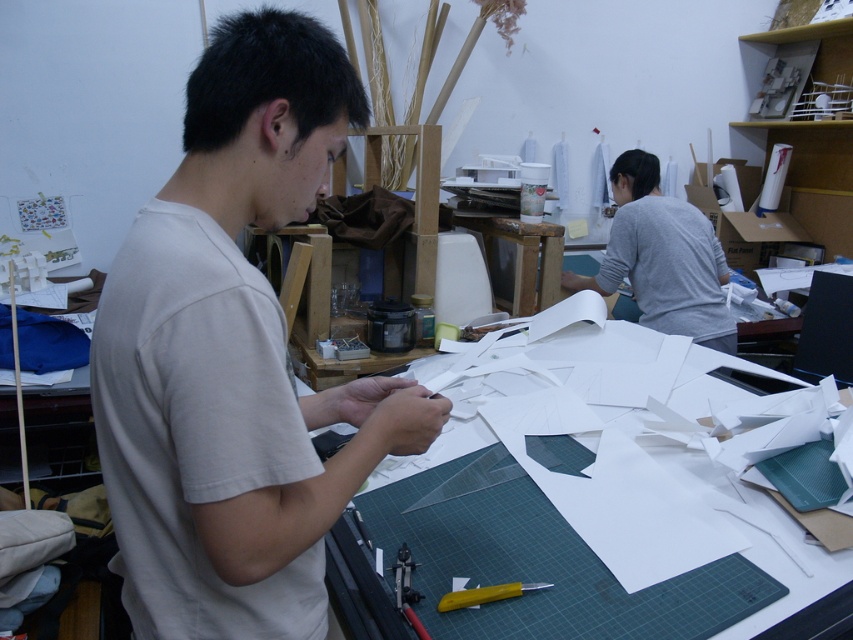
You are standing in front of the workspace and want to determine which of the two points, point (279,630) or point (654,476), is nearer to you. Based on the scene, which point is closer?

Point (279,630) is closer to the viewer than point (654,476).

You are an observer looking at the workspace. Which object is smaller in size between the white matte shirt at center and the white paper at center?

The white matte shirt at center has a smaller size compared to the white paper at center, so the white matte shirt at center is smaller.

You are an observer standing in front of the workspace. You notice the white matte shirt at center and the white paper at center. Which object is positioned to the left?

The white matte shirt at center is to the left of the white paper at center.